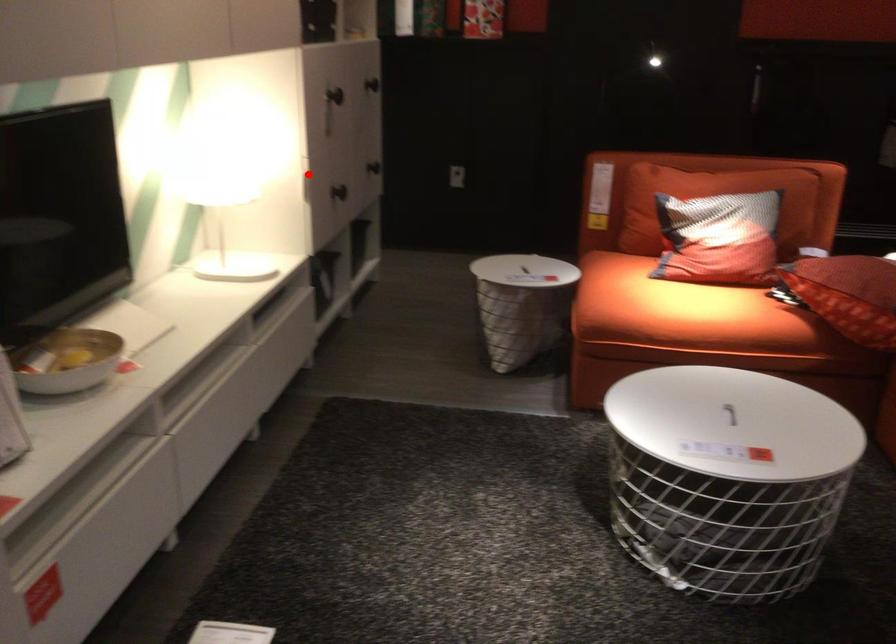
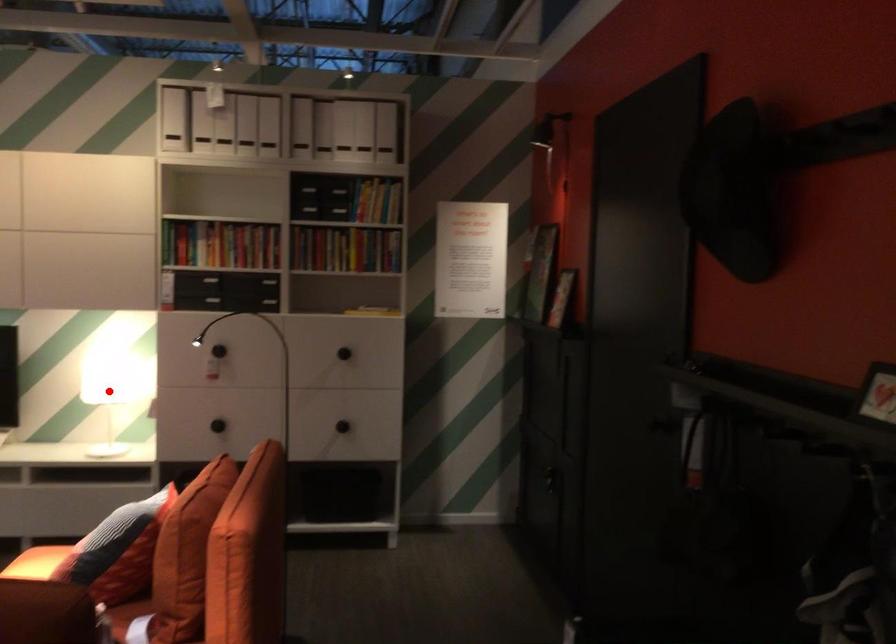
I am providing you with two images of the same scene from different viewpoints. A red point is marked on the first image and another point is marked on the second image. Is the marked point in image1 the same physical position as the marked point in image2?

Yes